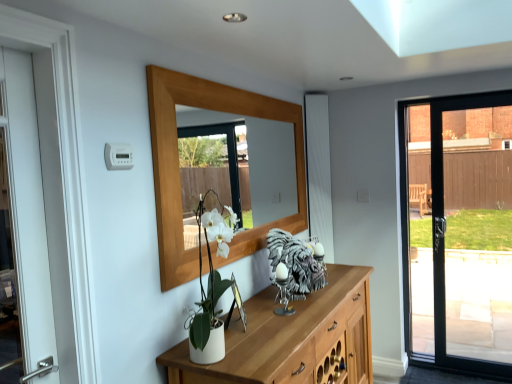
Question: Considering the relative sizes of wooden mirror at upper center and metallic silver picture frame at center in the image provided, is wooden mirror at upper center bigger than metallic silver picture frame at center?

Choices:
 (A) no
 (B) yes

Answer: (B)

Question: From a real-world perspective, is wooden mirror at upper center positioned over metallic silver picture frame at center based on gravity?

Choices:
 (A) yes
 (B) no

Answer: (A)

Question: Is wooden mirror at upper center not inside metallic silver picture frame at center?

Choices:
 (A) no
 (B) yes

Answer: (B)

Question: Considering the relative sizes of wooden mirror at upper center and metallic silver picture frame at center in the image provided, is wooden mirror at upper center wider than metallic silver picture frame at center?

Choices:
 (A) yes
 (B) no

Answer: (B)

Question: Can you confirm if wooden mirror at upper center is smaller than metallic silver picture frame at center?

Choices:
 (A) yes
 (B) no

Answer: (B)

Question: Considering the relative positions of shiny silver sculpture at center and wooden mirror at upper center in the image provided, is shiny silver sculpture at center to the left or to the right of wooden mirror at upper center?

Choices:
 (A) left
 (B) right

Answer: (B)

Question: Does point (294, 271) appear closer or farther from the camera than point (180, 142)?

Choices:
 (A) farther
 (B) closer

Answer: (B)

Question: Is shiny silver sculpture at center taller or shorter than wooden mirror at upper center?

Choices:
 (A) short
 (B) tall

Answer: (A)

Question: Is shiny silver sculpture at center wider or thinner than wooden mirror at upper center?

Choices:
 (A) wide
 (B) thin

Answer: (A)

Question: In terms of width, does metallic silver picture frame at center look wider or thinner when compared to wooden mirror at upper center?

Choices:
 (A) thin
 (B) wide

Answer: (B)

Question: From a real-world perspective, is metallic silver picture frame at center above or below wooden mirror at upper center?

Choices:
 (A) below
 (B) above

Answer: (A)

Question: From their relative heights in the image, would you say metallic silver picture frame at center is taller or shorter than wooden mirror at upper center?

Choices:
 (A) short
 (B) tall

Answer: (A)

Question: From the image's perspective, is metallic silver picture frame at center positioned above or below wooden mirror at upper center?

Choices:
 (A) below
 (B) above

Answer: (A)

Question: From the image's perspective, is shiny silver sculpture at center located above or below metallic silver picture frame at center?

Choices:
 (A) above
 (B) below

Answer: (A)

Question: Do you think shiny silver sculpture at center is within metallic silver picture frame at center, or outside of it?

Choices:
 (A) inside
 (B) outside

Answer: (B)